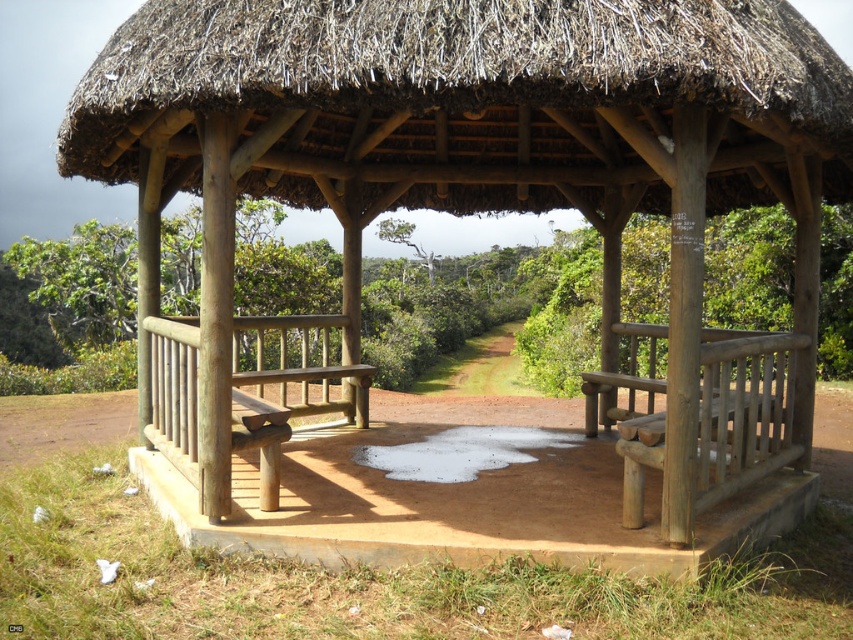
Between point (143, 120) and point (717, 449), which one is positioned behind?

Point (717, 449)

Who is more forward, (119, 68) or (747, 388)?

Positioned in front is point (119, 68).

What do you see at coordinates (467, 93) in the screenshot?
I see `thatched straw roof at center` at bounding box center [467, 93].

The image size is (853, 640). What are the coordinates of `thatched straw roof at center` in the screenshot? It's located at (467, 93).